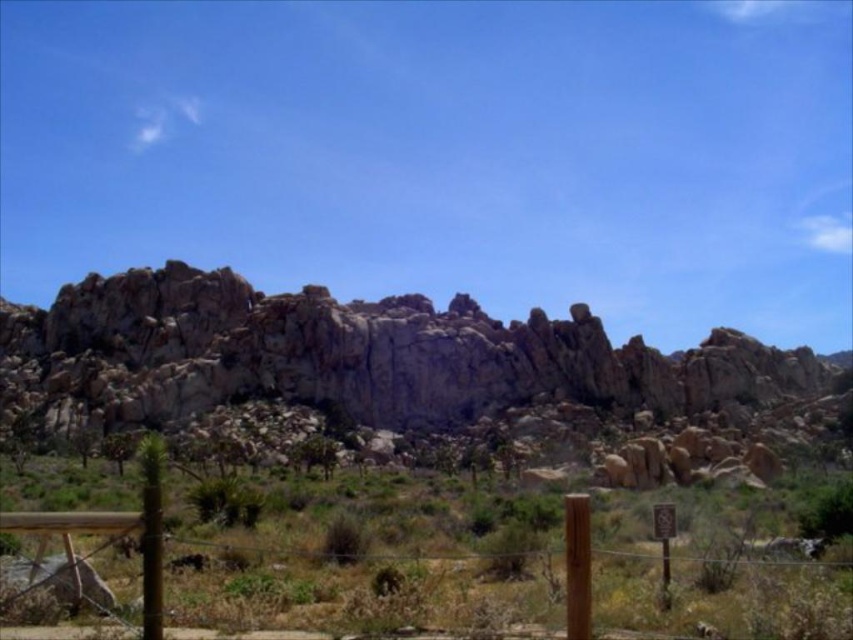
Consider the image. Measure the distance from rocky gray mountain at center to brown wooden fence at lower center.

The distance of rocky gray mountain at center from brown wooden fence at lower center is 66.80 meters.

Between rocky gray mountain at center and brown wooden fence at lower center, which one is positioned higher?

rocky gray mountain at center is above.

Between point (370, 336) and point (457, 628), which one is positioned in front?

Point (457, 628)

The height and width of the screenshot is (640, 853). I want to click on rocky gray mountain at center, so click(357, 355).